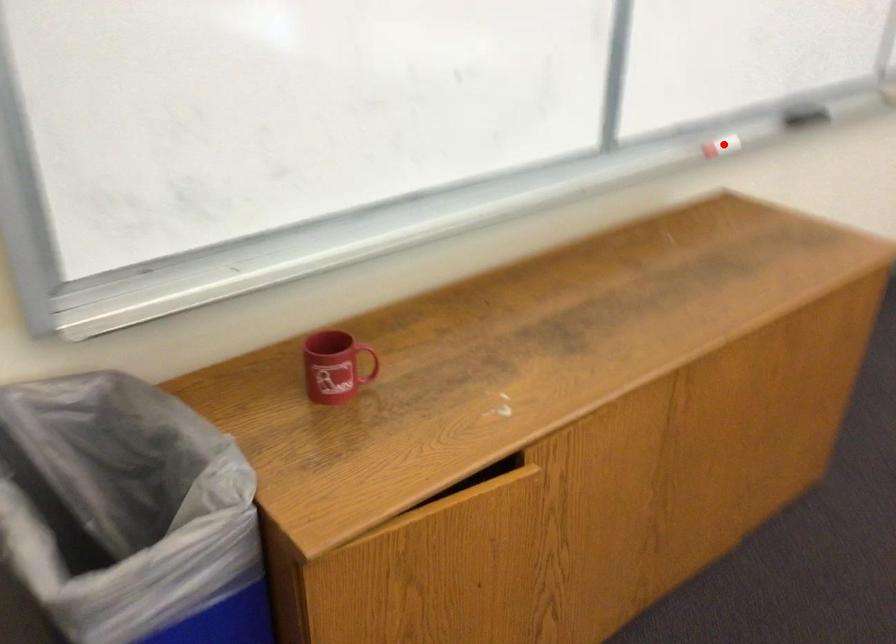
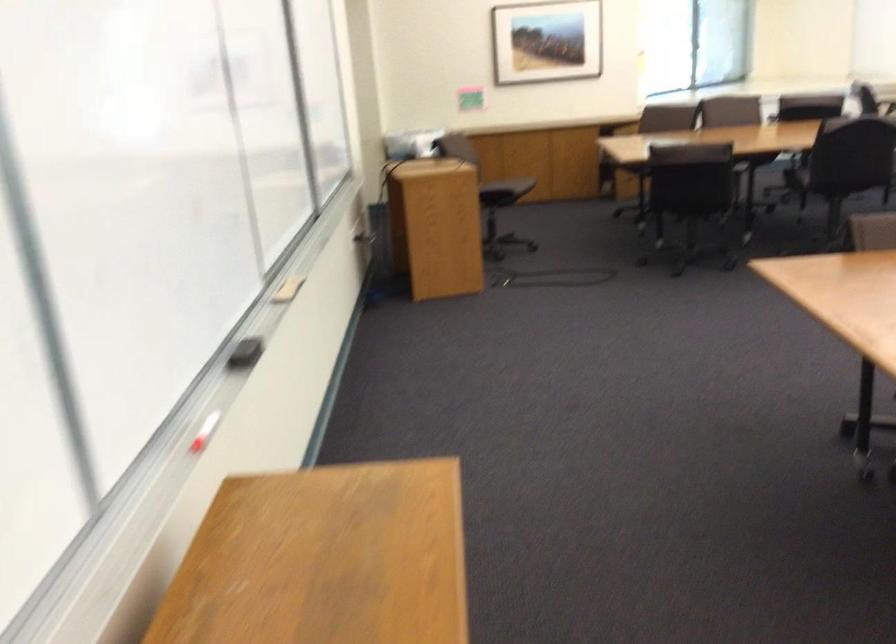
Question: I am providing you with two images of the same scene from different viewpoints. Given a red point in image1, look at the same physical point in image2. Is it:

Choices:
 (A) Closer to the viewpoint
 (B) Farther from the viewpoint

Answer: (A)